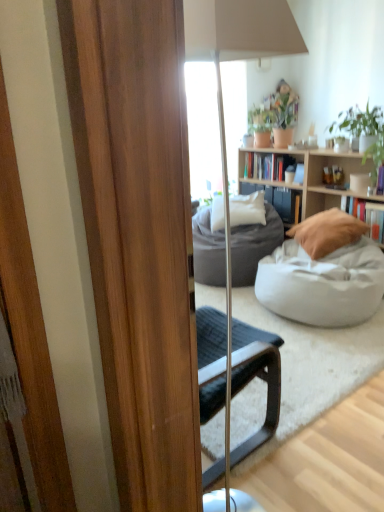
Question: From the image's perspective, is light wood bookcase at center positioned above or below hardcover book at right, positioned as the first book in bottom-to-top order?

Choices:
 (A) below
 (B) above

Answer: (B)

Question: Is light wood bookcase at center wider or thinner than hardcover book at right, the first book in the right-to-left sequence?

Choices:
 (A) wide
 (B) thin

Answer: (A)

Question: Which object is the farthest from the white fabric bean bag at center, the first studio couch viewed from the front?

Choices:
 (A) matte beige lamp at center
 (B) white soft pillow at center, positioned as the 2th pillow in front-to-back order
 (C) hardcover books at center, which is the second book in bottom-to-top order
 (D) dark gray fabric studio couch at center, the 1th studio couch viewed from the back
 (E) light wood bookcase at center

Answer: (A)

Question: Estimate the real-world distances between objects in this image. Which object is closer to the matte beige lamp at center?

Choices:
 (A) white fabric bean bag at center, the first studio couch viewed from the front
 (B) white soft pillow at center, the 1th pillow in the left-to-right sequence
 (C) hardcover books at center, which is counted as the first book, starting from the top
 (D) dark gray fabric studio couch at center, which is the second studio couch from front to back
 (E) light wood bookcase at center

Answer: (A)